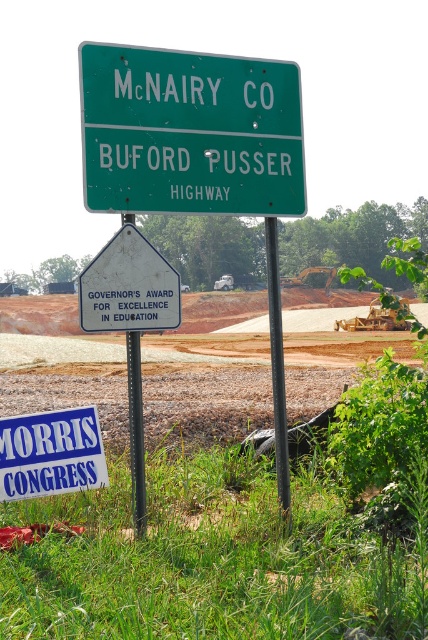
Can you confirm if green grass at lower center is thinner than green matte highway sign at upper center?

No, green grass at lower center is not thinner than green matte highway sign at upper center.

Does green grass at lower center have a lesser height compared to green matte highway sign at upper center?

Correct, green grass at lower center is not as tall as green matte highway sign at upper center.

Is point (407, 544) positioned before point (162, 186)?

Yes, it is.

Where is `green grass at lower center`? Image resolution: width=428 pixels, height=640 pixels. green grass at lower center is located at coordinates (219, 560).

Does green matte highway sign at upper center have a greater height compared to black metal pole at center?

In fact, green matte highway sign at upper center may be shorter than black metal pole at center.

Describe the element at coordinates (190, 132) in the screenshot. I see `green matte highway sign at upper center` at that location.

The height and width of the screenshot is (640, 428). Find the location of `green matte highway sign at upper center`. green matte highway sign at upper center is located at coordinates (190, 132).

Describe the element at coordinates (219, 560) in the screenshot. I see `green grass at lower center` at that location.

Between green grass at lower center and white plastic sign at center, which one has less height?

green grass at lower center is shorter.

Locate an element on the screen. green grass at lower center is located at coordinates (219, 560).